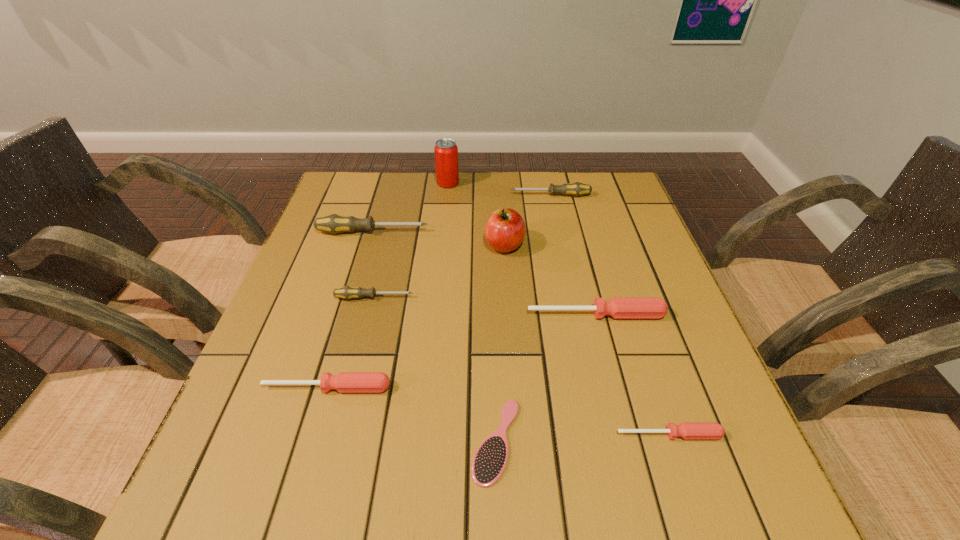
Where is `the sixth object from right to left`? The width and height of the screenshot is (960, 540). the sixth object from right to left is located at coordinates (446, 151).

Locate an element on the screen. the farthest object is located at coordinates (446, 151).

This screenshot has width=960, height=540. What are the coordinates of `apple` in the screenshot? It's located at (505, 229).

I want to click on red apple, so click(x=505, y=229).

This screenshot has width=960, height=540. In order to click on the fifth nearest screwdriver in this screenshot , I will do [334, 223].

Where is `the second nearest gray screwdriver`? This screenshot has height=540, width=960. the second nearest gray screwdriver is located at coordinates pos(334,223).

You are a GUI agent. You are given a task and a screenshot of the screen. Output one action in this format:
    pyautogui.click(x=<x>, y=<y>)
    Task: Click on the farthest gray screwdriver
    The height and width of the screenshot is (540, 960).
    Given the screenshot: What is the action you would take?
    pyautogui.click(x=575, y=189)

This screenshot has width=960, height=540. Identify the location of the second biggest gray screwdriver. (575, 189).

Locate an element on the screen. This screenshot has height=540, width=960. the third nearest screwdriver is located at coordinates (618, 307).

Image resolution: width=960 pixels, height=540 pixels. Find the location of `the fourth nearest object`. the fourth nearest object is located at coordinates (618, 307).